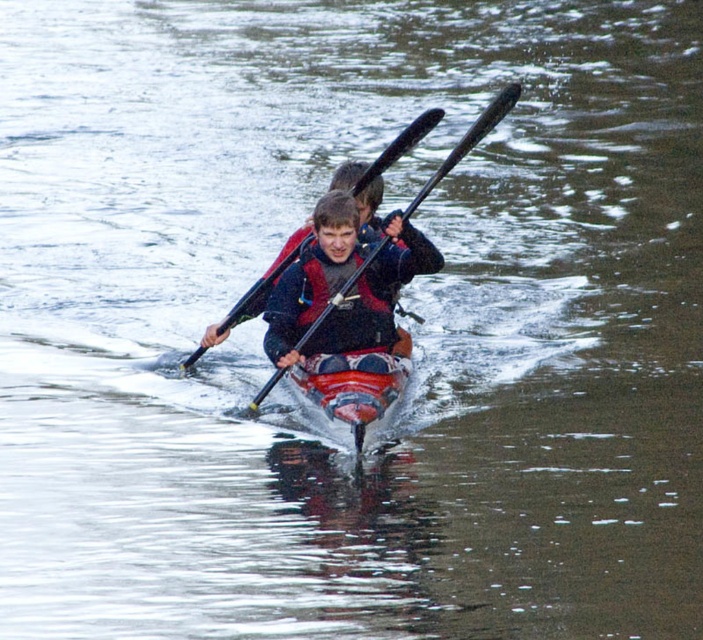
You are planning to store the red plastic canoe at center and the black plastic paddle at center in a storage room. If the storage space is only wide enough for the narrower item, which item should you prioritize storing first?

The red plastic canoe at center has a lesser width compared to the black plastic paddle at center, so you should prioritize storing the red plastic canoe at center first since it is narrower and fits better in the storage space.

Looking at this image, you are standing on a dock and see a point in the water at coordinates point (344, 339). If you want to throw a lifebuoy to someone who is 17.48 meters away from you, can you reach that point with your throw?

The point (344, 339) is 17.48 meters from the viewer, so yes, you can reach that point with your throw if your throwing distance is at least 17.48 meters.

You are a safety inspector checking the kayaking equipment. You see the matte red life jacket at center and the red plastic canoe at center. Which one has a greater height?

The matte red life jacket at center is much taller than the red plastic canoe at center.